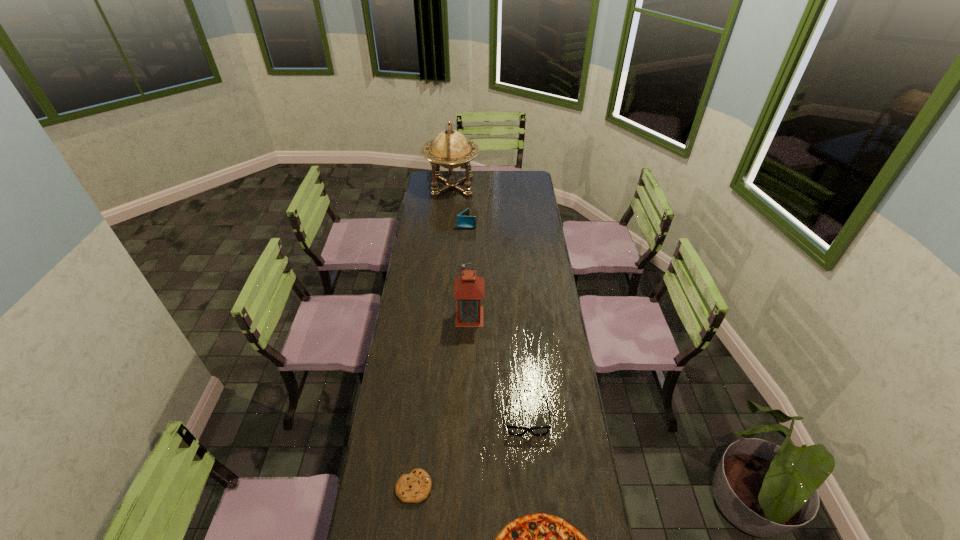
Where is `free location located on the front-facing side of the farthest object`? free location located on the front-facing side of the farthest object is located at coordinates point(500,186).

This screenshot has height=540, width=960. I want to click on free point located on the front of the fourth farthest object, so click(469, 347).

The width and height of the screenshot is (960, 540). What are the coordinates of `vacant area located 0.270m on the left of the third farthest object` in the screenshot? It's located at pyautogui.click(x=407, y=279).

Identify the location of free location located on the exterior surface of the wallet. The image size is (960, 540). (491, 225).

I want to click on vacant position located 0.050m on the front-facing side of the sunglasses, so click(530, 451).

In order to click on vacant area situated 0.190m on the right of the sixth farthest object in this screenshot , I will do `click(490, 487)`.

Where is `object that is at the far edge`? The height and width of the screenshot is (540, 960). object that is at the far edge is located at coordinates click(x=450, y=149).

Locate an element on the screen. globe that is at the left edge is located at coordinates [450, 149].

Find the location of a particular element. This screenshot has width=960, height=540. cookie present at the left edge is located at coordinates (414, 487).

Locate an element on the screen. object located at the right edge is located at coordinates (513, 430).